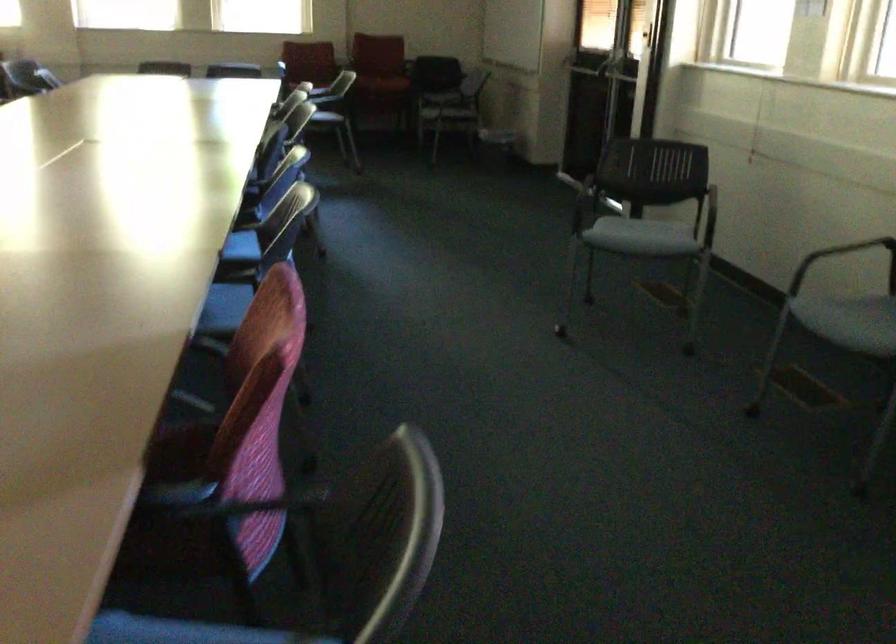
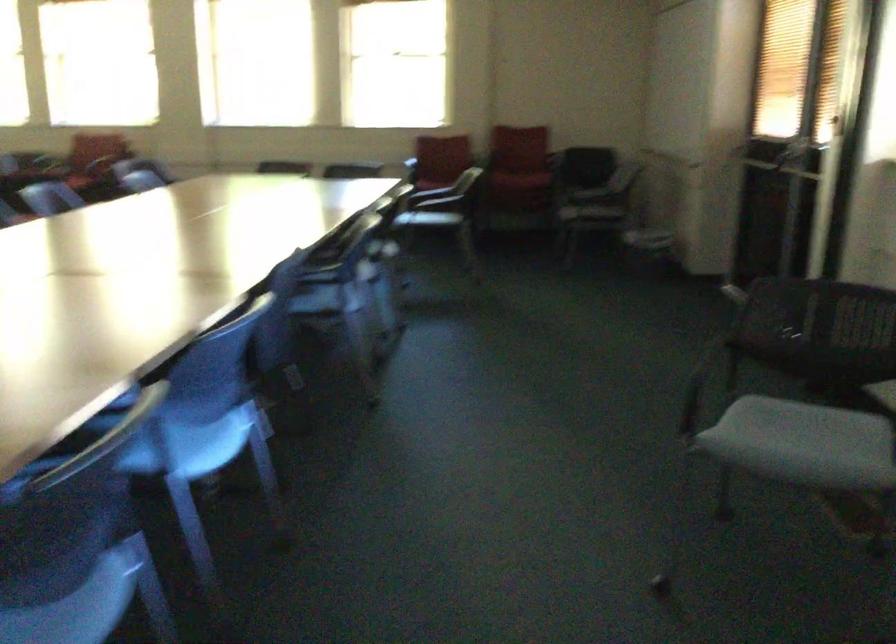
In the second image, find the point that corresponds to [670,228] in the first image.

(838, 444)